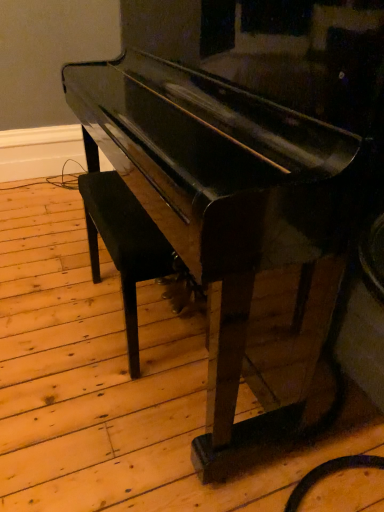
The image size is (384, 512). Find the location of `blank space situated above black fabric chair at center (from a real-world perspective)`. blank space situated above black fabric chair at center (from a real-world perspective) is located at coordinates (118, 201).